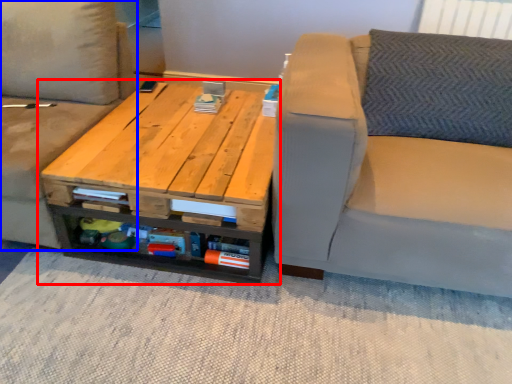
Question: Which of the following is the farthest to the observer, table (highlighted by a red box) or studio couch (highlighted by a blue box)?

Choices:
 (A) table
 (B) studio couch

Answer: (A)